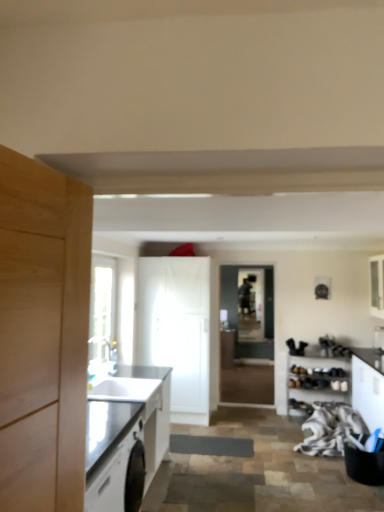
Question: Are matte black countertop at left, positioned as the 1th cabinetry in left-to-right order, and white matte shoe rack at lower right, the 3th cabinetry in the right-to-left sequence, making contact?

Choices:
 (A) yes
 (B) no

Answer: (B)

Question: Is matte black countertop at left, positioned as the 1th cabinetry in left-to-right order, outside white matte shoe rack at lower right, which appears as the 3th cabinetry when viewed from the left?

Choices:
 (A) yes
 (B) no

Answer: (A)

Question: Is white matte shoe rack at lower right, the 3th cabinetry in the right-to-left sequence, surrounded by matte black countertop at left, acting as the 5th cabinetry starting from the right?

Choices:
 (A) no
 (B) yes

Answer: (A)

Question: Is white matte shoe rack at lower right, which appears as the 3th cabinetry when viewed from the left, at the back of matte black countertop at left, positioned as the 1th cabinetry in left-to-right order?

Choices:
 (A) no
 (B) yes

Answer: (A)

Question: Considering the relative positions of matte black countertop at left, acting as the 5th cabinetry starting from the right, and white matte shoe rack at lower right, which appears as the 3th cabinetry when viewed from the left, in the image provided, is matte black countertop at left, acting as the 5th cabinetry starting from the right, to the right of white matte shoe rack at lower right, which appears as the 3th cabinetry when viewed from the left, from the viewer's perspective?

Choices:
 (A) no
 (B) yes

Answer: (A)

Question: Looking at their shapes, would you say white glossy cabinet at center, positioned as the fourth cabinetry in right-to-left order, is wider or thinner than matte black countertop at left, positioned as the 1th cabinetry in left-to-right order?

Choices:
 (A) wide
 (B) thin

Answer: (B)

Question: From a real-world perspective, is white glossy cabinet at center, the second cabinetry in the left-to-right sequence, above or below matte black countertop at left, acting as the 5th cabinetry starting from the right?

Choices:
 (A) above
 (B) below

Answer: (A)

Question: From the image's perspective, relative to matte black countertop at left, positioned as the 1th cabinetry in left-to-right order, is white glossy cabinet at center, positioned as the fourth cabinetry in right-to-left order, above or below?

Choices:
 (A) above
 (B) below

Answer: (A)

Question: In terms of height, does white glossy cabinet at center, positioned as the fourth cabinetry in right-to-left order, look taller or shorter compared to matte black countertop at left, acting as the 5th cabinetry starting from the right?

Choices:
 (A) short
 (B) tall

Answer: (B)

Question: Do you think white glossy cabinet at right, placed as the fourth cabinetry when sorted from left to right, is within white matte shoe rack at lower right, the 3th cabinetry in the right-to-left sequence, or outside of it?

Choices:
 (A) inside
 (B) outside

Answer: (B)

Question: From a real-world perspective, relative to white matte shoe rack at lower right, which appears as the 3th cabinetry when viewed from the left, is white glossy cabinet at right, placed as the fourth cabinetry when sorted from left to right, vertically above or below?

Choices:
 (A) above
 (B) below

Answer: (A)

Question: From the image's perspective, is white glossy cabinet at right, placed as the fourth cabinetry when sorted from left to right, above or below white matte shoe rack at lower right, which appears as the 3th cabinetry when viewed from the left?

Choices:
 (A) above
 (B) below

Answer: (A)

Question: Relative to white matte shoe rack at lower right, the 3th cabinetry in the right-to-left sequence, is white glossy cabinet at right, placed as the fourth cabinetry when sorted from left to right, in front or behind?

Choices:
 (A) behind
 (B) front

Answer: (B)

Question: Looking at the image, does transparent glass window screen at center seem bigger or smaller compared to white textured fabric at lower right?

Choices:
 (A) small
 (B) big

Answer: (A)

Question: Does point (251, 332) appear closer or farther from the camera than point (337, 432)?

Choices:
 (A) farther
 (B) closer

Answer: (A)